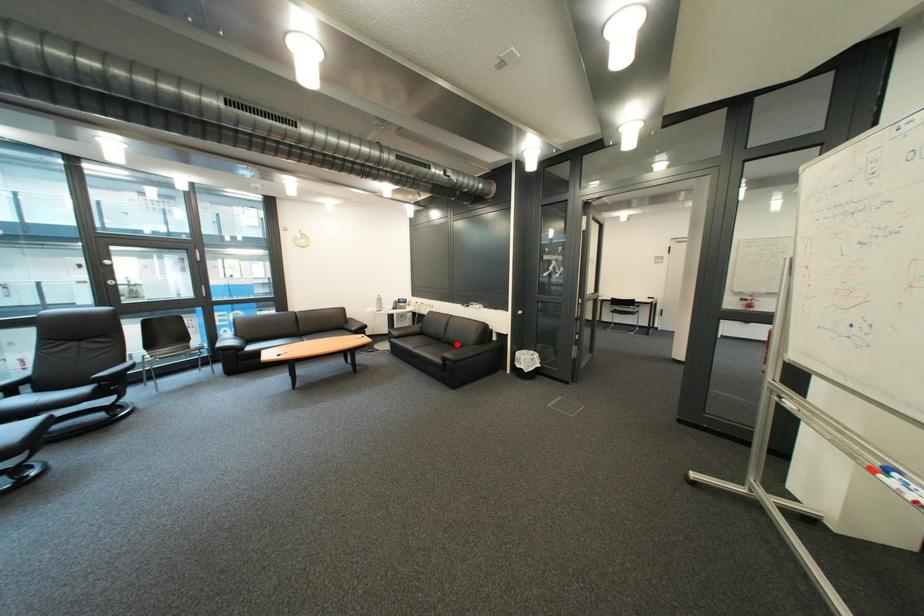
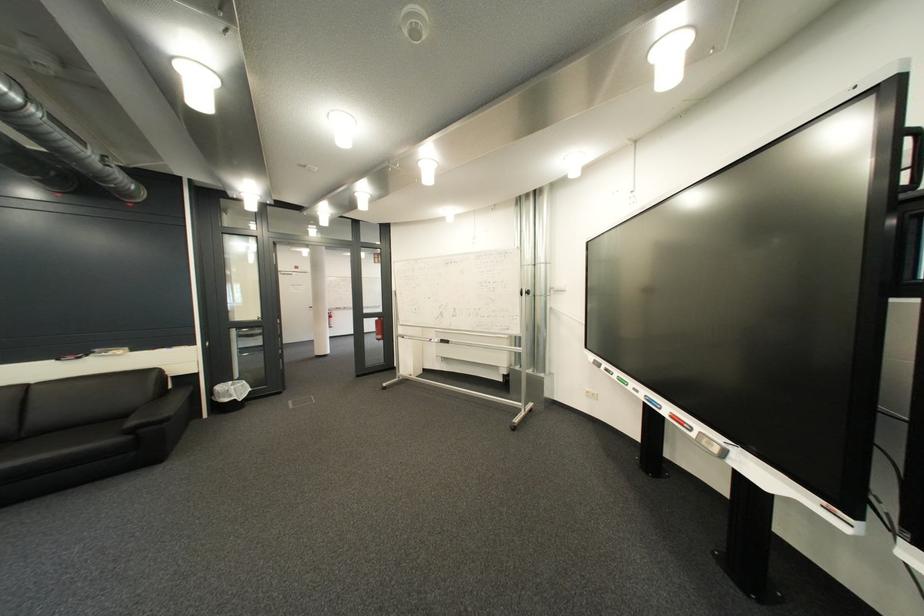
Question: I am providing you with two images of the same scene from different viewpoints. Given a red point in image1, look at the same physical point in image2. Is it:

Choices:
 (A) Closer to the viewpoint
 (B) Farther from the viewpoint

Answer: (A)